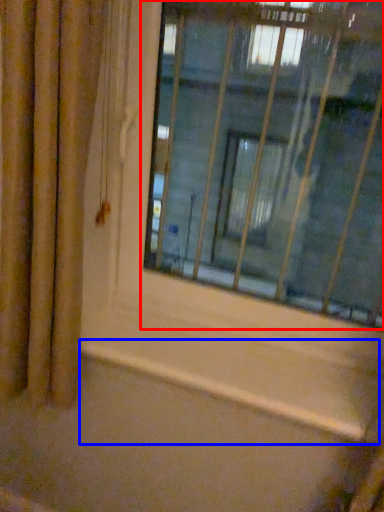
Question: Which object appears closest to the camera in this image, window (highlighted by a red box) or window sill (highlighted by a blue box)?

Choices:
 (A) window
 (B) window sill

Answer: (A)